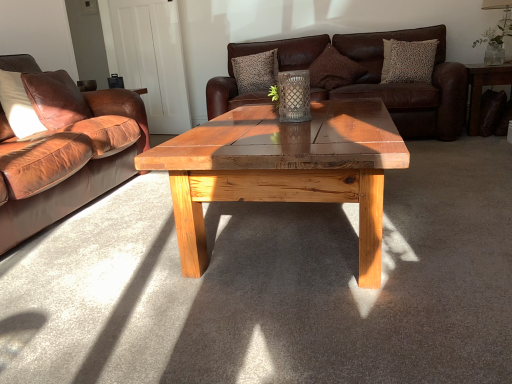
Question: Should I look upward or downward to see patterned fabric pillow at upper right, which is the 4th pillow from left to right?

Choices:
 (A) down
 (B) up

Answer: (B)

Question: Can you confirm if textured brown pillow at upper center, the first pillow positioned from the back, is taller than clear glass vase at upper right?

Choices:
 (A) no
 (B) yes

Answer: (B)

Question: Does textured brown pillow at upper center, the first pillow positioned from the back, have a smaller size compared to clear glass vase at upper right?

Choices:
 (A) no
 (B) yes

Answer: (A)

Question: Is the surface of textured brown pillow at upper center, which ranks as the fourth pillow in front-to-back order, in direct contact with clear glass vase at upper right?

Choices:
 (A) no
 (B) yes

Answer: (A)

Question: Is the depth of textured brown pillow at upper center, which ranks as the fourth pillow in front-to-back order, less than that of clear glass vase at upper right?

Choices:
 (A) yes
 (B) no

Answer: (B)

Question: Can clear glass vase at upper right be found inside textured brown pillow at upper center, acting as the 2th pillow starting from the left?

Choices:
 (A) no
 (B) yes

Answer: (A)

Question: Is textured brown pillow at upper center, acting as the third pillow starting from the right, oriented away from clear glass vase at upper right?

Choices:
 (A) no
 (B) yes

Answer: (A)

Question: From the image's perspective, is matte white lampshade at upper right over brown leather couch at left, which is the first studio couch in front-to-back order?

Choices:
 (A) no
 (B) yes

Answer: (B)

Question: Does matte white lampshade at upper right appear on the left side of brown leather couch at left, the 2th studio couch from the back?

Choices:
 (A) no
 (B) yes

Answer: (A)

Question: Is matte white lampshade at upper right outside of brown leather couch at left, marked as the 1th studio couch in a left-to-right arrangement?

Choices:
 (A) yes
 (B) no

Answer: (A)

Question: Is matte white lampshade at upper right oriented towards brown leather couch at left, the 2th studio couch from the back?

Choices:
 (A) yes
 (B) no

Answer: (B)

Question: Can you confirm if matte white lampshade at upper right is taller than brown leather couch at left, which is the first studio couch in front-to-back order?

Choices:
 (A) yes
 (B) no

Answer: (B)

Question: Is the position of matte white lampshade at upper right less distant than that of brown leather couch at left, the 2th studio couch viewed from the right?

Choices:
 (A) yes
 (B) no

Answer: (B)

Question: From a real-world perspective, is clear glass vase at upper right under brown leather couch at left, marked as the 1th studio couch in a left-to-right arrangement?

Choices:
 (A) yes
 (B) no

Answer: (B)